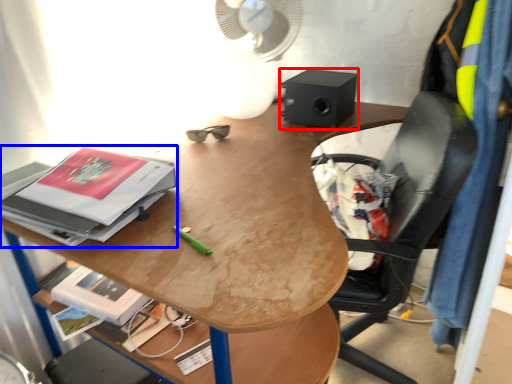
Question: Which of the following is the farthest to the observer, loudspeaker (highlighted by a red box) or paperback book (highlighted by a blue box)?

Choices:
 (A) loudspeaker
 (B) paperback book

Answer: (A)